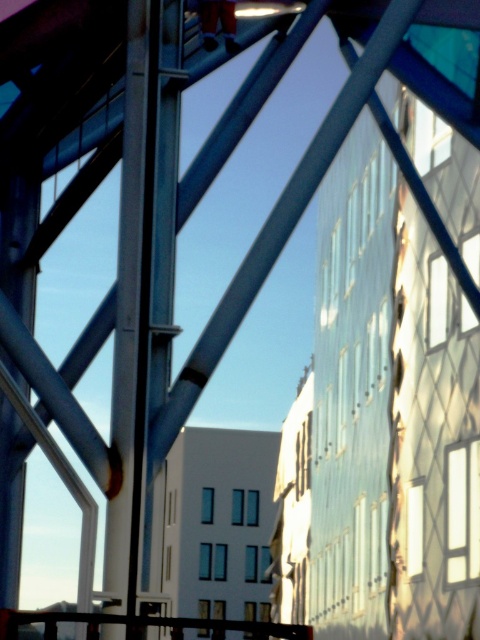
You are a construction worker assessing the structural integrity of the scene. You notice the metallic pole at center and the black metal rail at lower center. Which object has a smaller diameter?

The metallic pole at center has a smaller diameter than the black metal rail at lower center.

You are a maintenance worker needing to reach the metallic pole at center from the black metal rail at lower center. Given that your ladder is 20 feet long, will it be sufficient to bridge the gap between them?

The distance between the metallic pole at center and the black metal rail at lower center is 22.06 feet. Since the ladder is only 20 feet long, it will not be sufficient to bridge the gap between them.